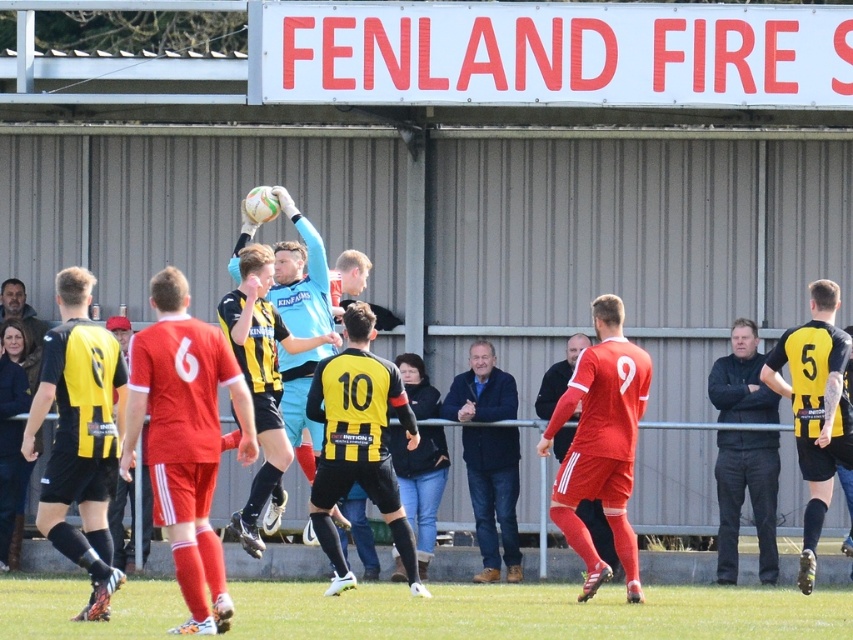
You are a photographer trying to capture the goalkeeper in action. You notice two points marked on your camera screen at coordinates point (115, 448) and point (773, 536). Which point should you focus on to ensure the goalkeeper is in sharp focus?

You should focus on point (115, 448) because it is closer to the camera than point (773, 536), ensuring the goalkeeper is in focus.